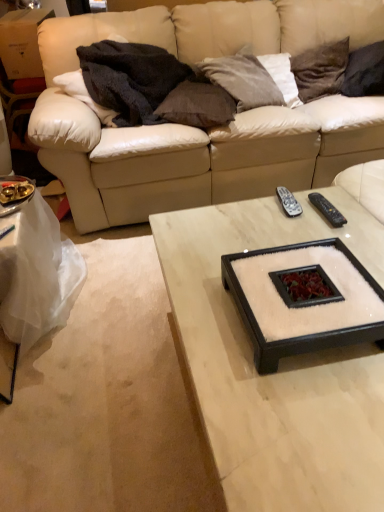
Where is `vacant region to the left of white felt square tray at center`? This screenshot has height=512, width=384. vacant region to the left of white felt square tray at center is located at coordinates (202, 314).